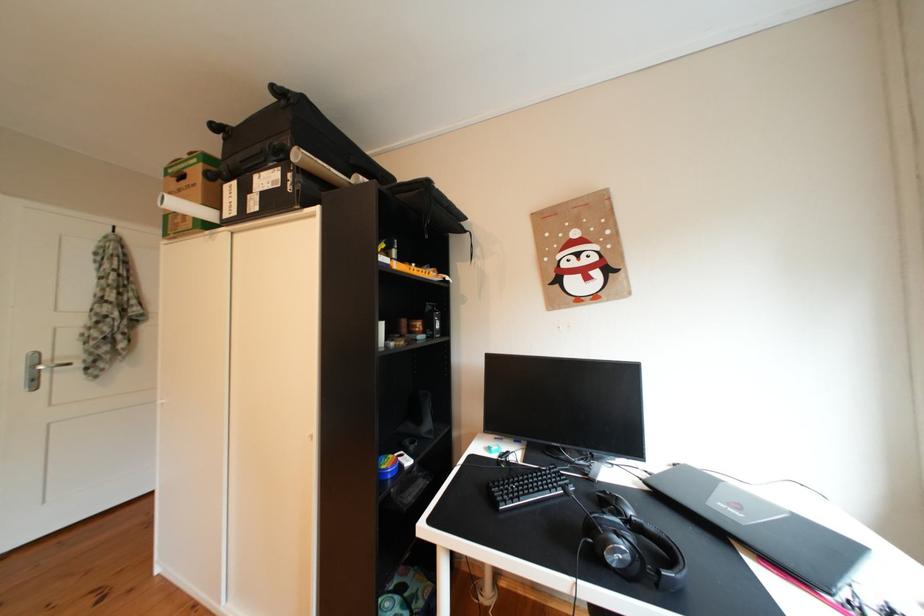
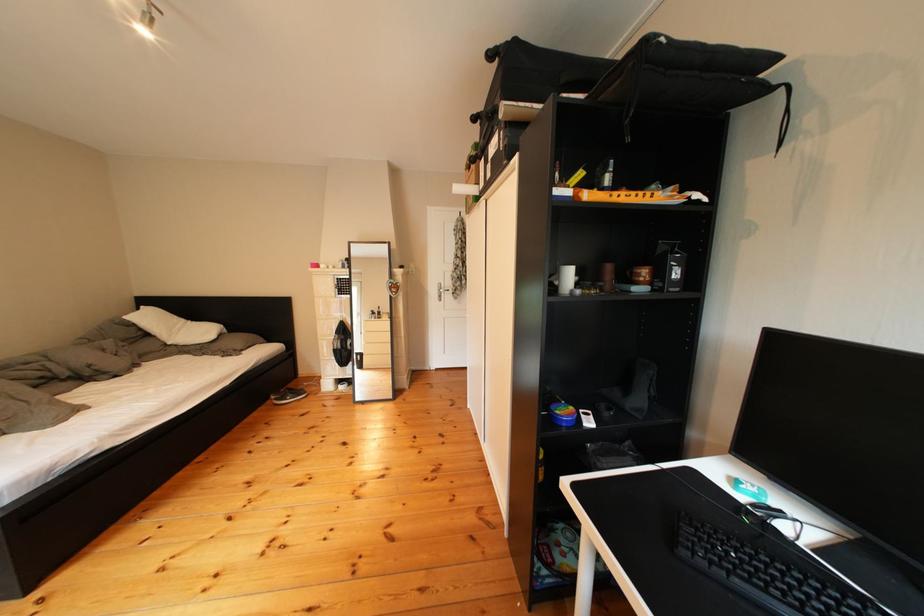
In the second image, find the point that corresponds to pixel 84 355 in the first image.

(463, 288)